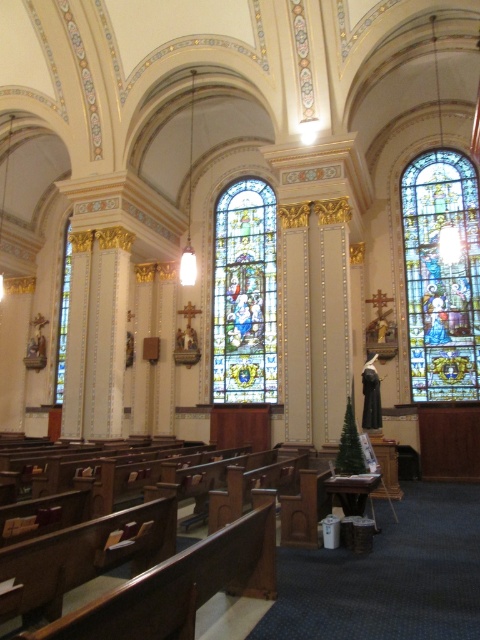
Question: Which point is farther to the camera?

Choices:
 (A) stained glass window at left
 (B) stained glass window at center
 (C) stained glass window at right

Answer: (A)

Question: Which point appears farthest from the camera in this image?

Choices:
 (A) (224, 225)
 (B) (439, 294)

Answer: (A)

Question: Is stained glass window at right closer to the viewer compared to stained glass window at center?

Choices:
 (A) no
 (B) yes

Answer: (B)

Question: Does stained glass window at right have a greater width compared to stained glass window at center?

Choices:
 (A) yes
 (B) no

Answer: (A)

Question: In this image, where is stained glass window at right located relative to stained glass window at center?

Choices:
 (A) left
 (B) right

Answer: (B)

Question: Which point is closer to the camera?

Choices:
 (A) (x=456, y=172)
 (B) (x=251, y=196)

Answer: (A)